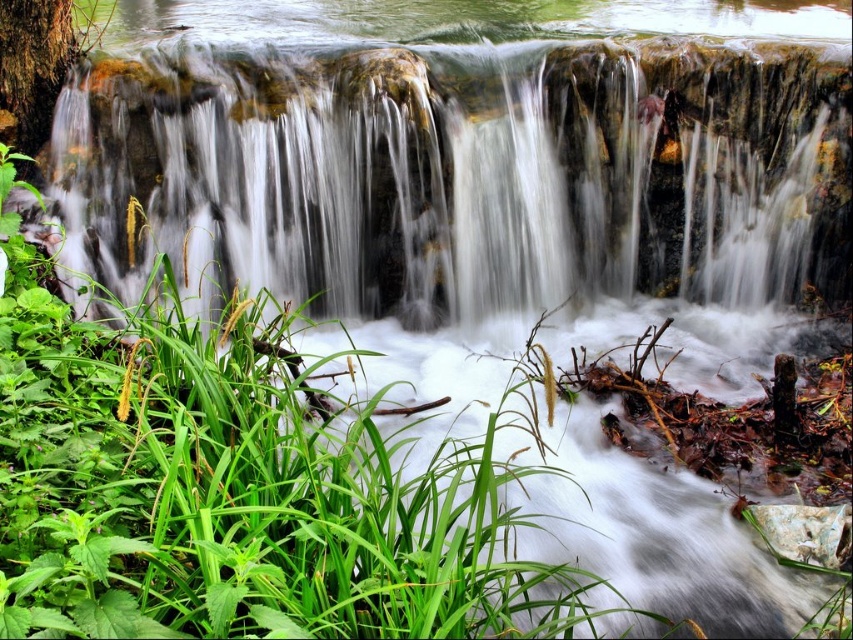
Is point (480, 198) closer to viewer compared to point (207, 548)?

No, it is not.

In the scene shown: Does translucent stone waterfall at upper center have a lesser width compared to green leafy grass at center?

Yes, translucent stone waterfall at upper center is thinner than green leafy grass at center.

The width and height of the screenshot is (853, 640). Find the location of `translucent stone waterfall at upper center`. translucent stone waterfall at upper center is located at coordinates (463, 173).